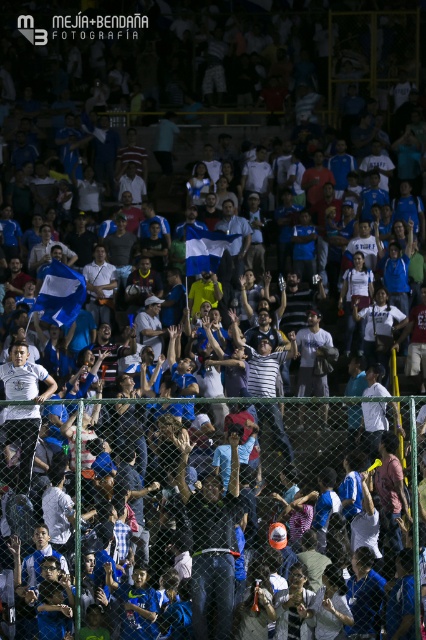
You are a photographer standing behind the green chain link fence in the foreground. You want to capture both the blue fabric flag at center and the white fabric flag at center in a single photo. Which flag should you position closer to the left side of your camera frame to include both?

You should position the blue fabric flag at center closer to the left side of your camera frame since it is already to the left of the white fabric flag at center in the scene.

You are a photographer standing behind the green chain link fence in the foreground of the stadium scene. You want to capture a photo of both the blue fabric flag at center and the white fabric flag at center. Based on their positions, which flag should you adjust your camera angle to focus on first to ensure both are in frame?

The blue fabric flag at center is located below the white fabric flag at center, so you should focus on the white fabric flag at center first to ensure both are visible in the frame.

You are standing at the entrance of the stadium and want to locate the person wearing the dark gray fabric jacket at center. According to the coordinates provided, in which direction should you look relative to your current position?

The dark gray fabric jacket at center is located at coordinates point (210, 545). Since the x and y coordinates are both above 0.5, you should look to the upper right direction from your current position.